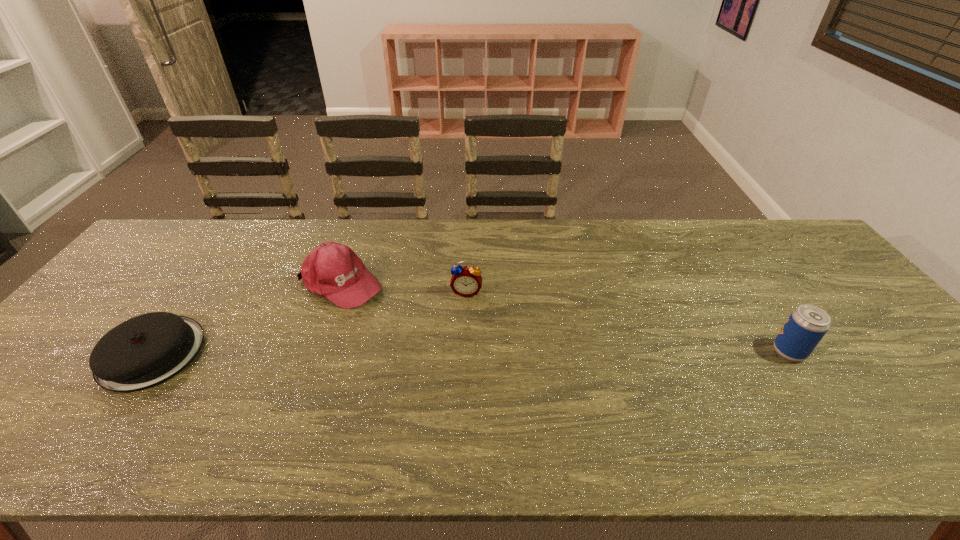
Where is `vacant space that's between the rightmost object and the second object from right to left`? vacant space that's between the rightmost object and the second object from right to left is located at coordinates 628,322.

In order to click on unoccupied area between the alarm clock and the beer can in this screenshot , I will do `click(628, 322)`.

Locate an element on the screen. free area in between the shortest object and the second object from left to right is located at coordinates (247, 318).

This screenshot has height=540, width=960. I want to click on object that is the second nearest to the third object from right to left, so click(466, 281).

Locate which object is the third closest to the leftmost object. Please provide its 2D coordinates. Your answer should be formatted as a tuple, i.e. [(x, y)], where the tuple contains the x and y coordinates of a point satisfying the conditions above.

[(807, 324)]

Find the location of a particular element. blank area in the image that satisfies the following two spatial constraints: 1. on the back side of the pancake; 2. on the left side of the second object from left to right is located at coordinates (202, 284).

You are a GUI agent. You are given a task and a screenshot of the screen. Output one action in this format:
    pyautogui.click(x=<x>, y=<y>)
    Task: Click on the vacant area that satisfies the following two spatial constraints: 1. on the front side of the second object from left to right; 2. on the right side of the beer can
    Image resolution: width=960 pixels, height=540 pixels.
    Given the screenshot: What is the action you would take?
    pyautogui.click(x=317, y=352)

Where is `vacant area in the image that satisfies the following two spatial constraints: 1. on the front side of the baseball cap; 2. on the left side of the beer can`? This screenshot has height=540, width=960. vacant area in the image that satisfies the following two spatial constraints: 1. on the front side of the baseball cap; 2. on the left side of the beer can is located at coordinates (317, 352).

Where is `free space that satisfies the following two spatial constraints: 1. on the back side of the leftmost object; 2. on the left side of the beer can`? This screenshot has width=960, height=540. free space that satisfies the following two spatial constraints: 1. on the back side of the leftmost object; 2. on the left side of the beer can is located at coordinates (154, 352).

Where is `free region that satisfies the following two spatial constraints: 1. on the front side of the third object from left to right; 2. on the left side of the beer can`? This screenshot has width=960, height=540. free region that satisfies the following two spatial constraints: 1. on the front side of the third object from left to right; 2. on the left side of the beer can is located at coordinates (465, 352).